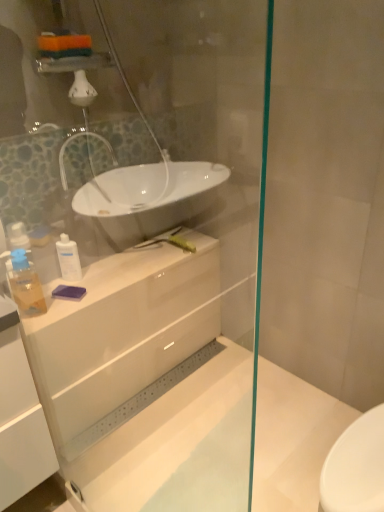
Question: Considering the positions of white glossy cabinet at center and translucent plastic soap dispenser at left, marked as the 2th toiletry in a back-to-front arrangement, in the image, is white glossy cabinet at center bigger or smaller than translucent plastic soap dispenser at left, marked as the 2th toiletry in a back-to-front arrangement,?

Choices:
 (A) small
 (B) big

Answer: (B)

Question: In the image, is white glossy cabinet at center on the left side or the right side of translucent plastic soap dispenser at left, marked as the 2th toiletry in a back-to-front arrangement?

Choices:
 (A) right
 (B) left

Answer: (A)

Question: Estimate the real-world distances between objects in this image. Which object is farther from the translucent plastic soap dispenser at left, the 1th toiletry viewed from the front?

Choices:
 (A) white glossy cabinet at center
 (B) white glossy lotion at center, the 2th toiletry positioned from the front
 (C) transparent glass shower door at upper center

Answer: (C)

Question: Estimate the real-world distances between objects in this image. Which object is closer to the white glossy cabinet at center?

Choices:
 (A) translucent plastic soap dispenser at left, marked as the 2th toiletry in a back-to-front arrangement
 (B) transparent glass shower door at upper center
 (C) white glossy lotion at center, the second toiletry in the left-to-right sequence

Answer: (B)